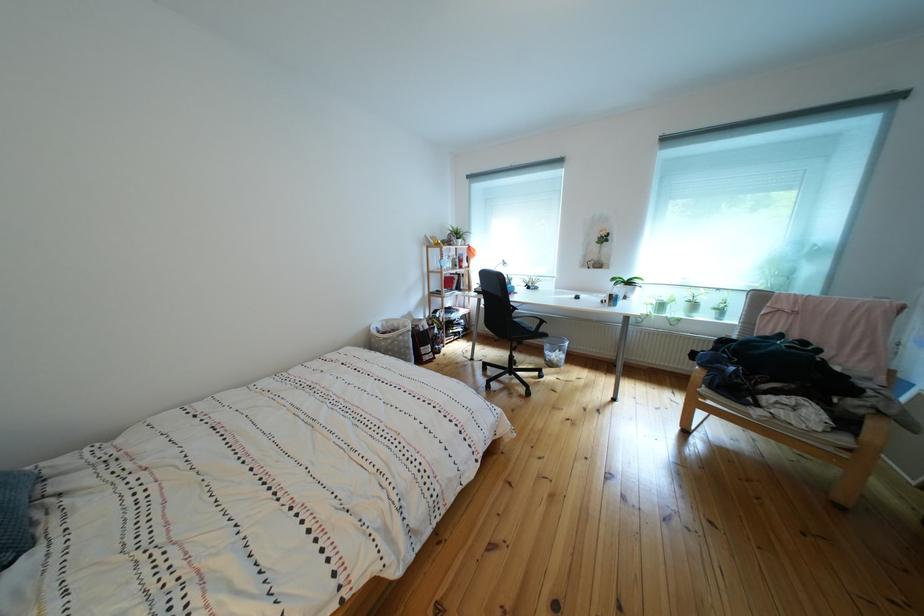
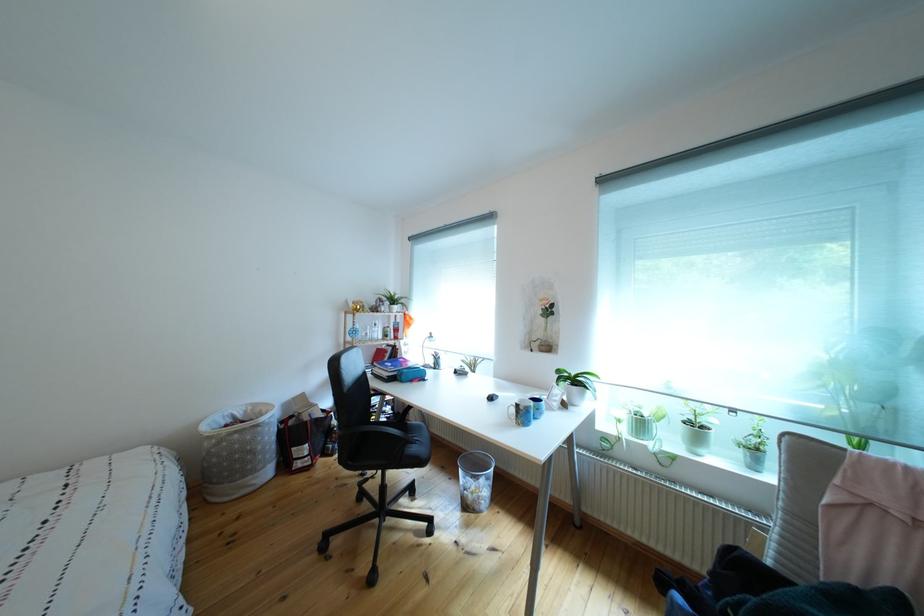
Locate, in the second image, the point that corresponds to point (458, 275) in the first image.

(383, 345)